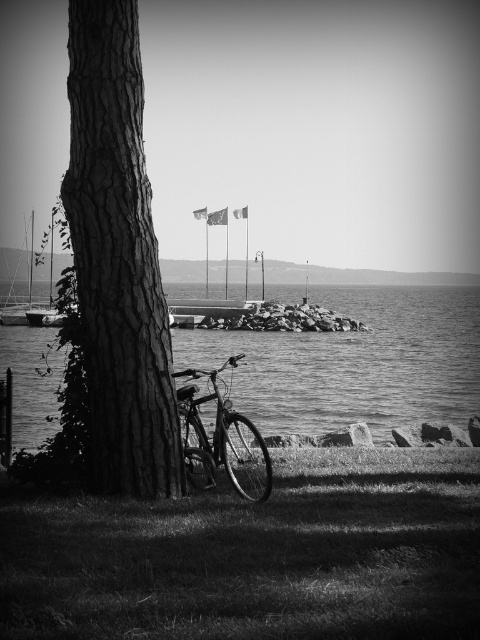
Question: Is metallic bicycle at lower left to the right of metallic sailboat at left from the viewer's perspective?

Choices:
 (A) no
 (B) yes

Answer: (B)

Question: Based on their relative distances, which object is nearer to the metallic bicycle at lower left?

Choices:
 (A) grassy lawn at lower left
 (B) metallic sailboat at left

Answer: (A)

Question: Is dark gray bark tree trunk at left positioned at the back of smooth water at center?

Choices:
 (A) yes
 (B) no

Answer: (B)

Question: Estimate the real-world distances between objects in this image. Which object is farther from the grassy lawn at lower left?

Choices:
 (A) smooth water at center
 (B) metallic sailboat at left

Answer: (B)

Question: Estimate the real-world distances between objects in this image. Which object is closer to the smooth water at center?

Choices:
 (A) metallic bicycle at lower left
 (B) grassy lawn at lower left
 (C) dark gray bark tree trunk at left
 (D) metallic sailboat at left

Answer: (D)

Question: Does dark gray bark tree trunk at left have a greater width compared to metallic bicycle at lower left?

Choices:
 (A) no
 (B) yes

Answer: (B)